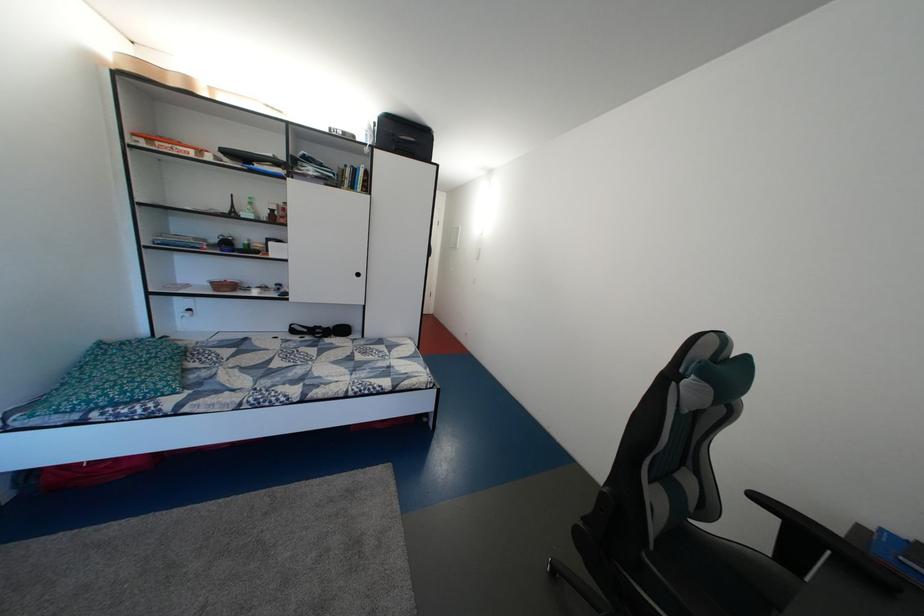
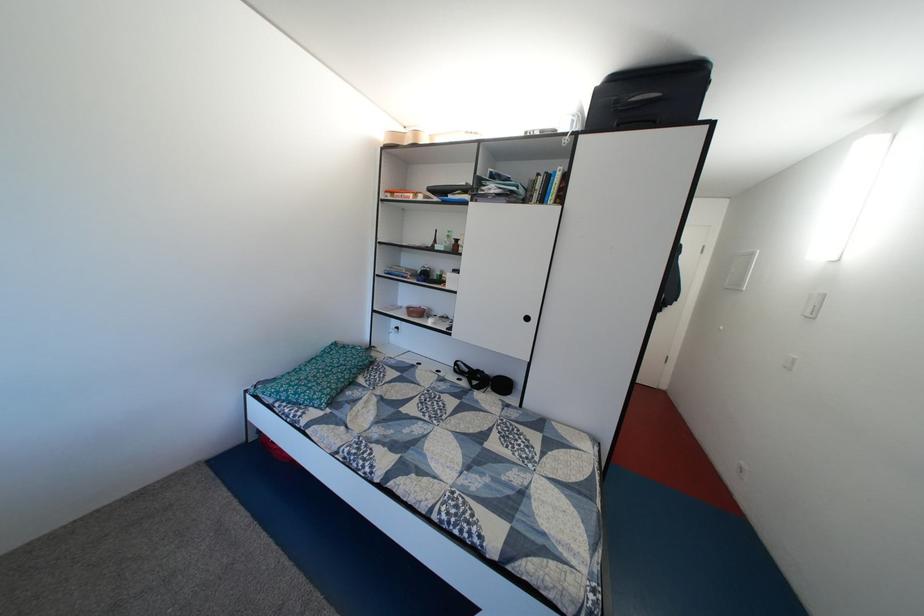
Question: The camera is either moving clockwise (left) or counter-clockwise (right) around the object. The first image is from the beginning of the video and the second image is from the end. Is the camera moving left or right when shooting the video?

Choices:
 (A) Left
 (B) Right

Answer: (B)